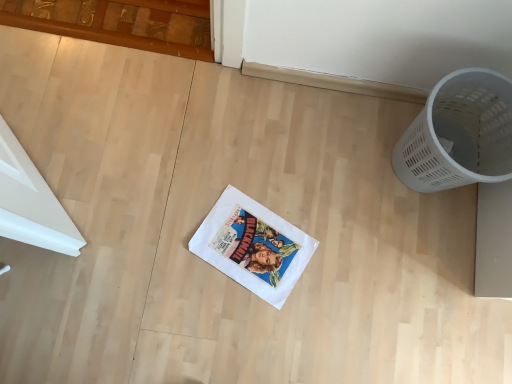
The image size is (512, 384). Find the location of `free space behind white paper comic book at center`. free space behind white paper comic book at center is located at coordinates (280, 174).